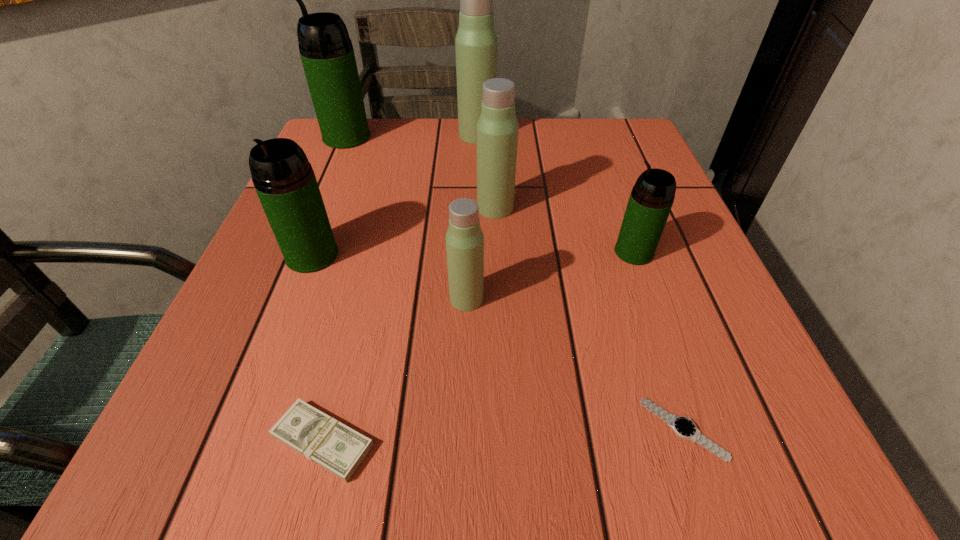
Where is `free space between the farthest light thermos bottle and the shortest object`? free space between the farthest light thermos bottle and the shortest object is located at coordinates (580, 282).

Identify the location of object that can be found as the second closest to the second shortest object. (284, 180).

Identify which object is the seventh closest to the money. Please provide its 2D coordinates. Your answer should be formatted as a tuple, i.e. [(x, y)], where the tuple contains the x and y coordinates of a point satisfying the conditions above.

[(476, 43)]

Point out which thermos bottle is positioned as the second nearest to the watch. Please provide its 2D coordinates. Your answer should be formatted as a tuple, i.e. [(x, y)], where the tuple contains the x and y coordinates of a point satisfying the conditions above.

[(464, 239)]

Choose which thermos bottle is the nearest neighbor to the nearest thermos bottle. Please provide its 2D coordinates. Your answer should be formatted as a tuple, i.e. [(x, y)], where the tuple contains the x and y coordinates of a point satisfying the conditions above.

[(497, 128)]

At what (x,y) coordinates should I click in order to perform the action: click on green thermos bottle identified as the closest to the second nearest light thermos bottle. Please return your answer as a coordinate pair (x, y). The image size is (960, 540). Looking at the image, I should click on (651, 199).

Where is `green thermos bottle that is the third closest to the money`? This screenshot has width=960, height=540. green thermos bottle that is the third closest to the money is located at coordinates (327, 54).

Select which light thermos bottle is the second closest to the rightmost green thermos bottle. Please provide its 2D coordinates. Your answer should be formatted as a tuple, i.e. [(x, y)], where the tuple contains the x and y coordinates of a point satisfying the conditions above.

[(464, 239)]

Locate an element on the screen. the closest light thermos bottle to the farthest green thermos bottle is located at coordinates (476, 43).

This screenshot has width=960, height=540. I want to click on free space that satisfies the following two spatial constraints: 1. on the back side of the fourth nearest thermos bottle; 2. on the left side of the sixth farthest object, so click(x=469, y=208).